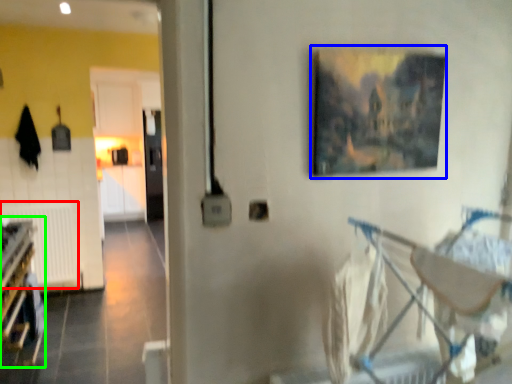
Question: Which object is positioned farthest from radiator (highlighted by a red box)? Select from picture frame (highlighted by a blue box) and bunk bed (highlighted by a green box).

Choices:
 (A) picture frame
 (B) bunk bed

Answer: (A)